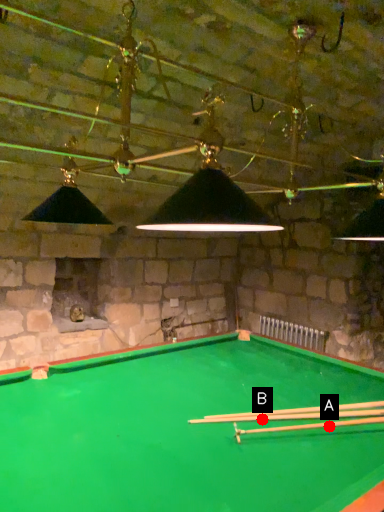
Question: Two points are circled on the image, labeled by A and B beside each circle. Which point is further to the camera?

Choices:
 (A) A is further
 (B) B is further

Answer: (B)